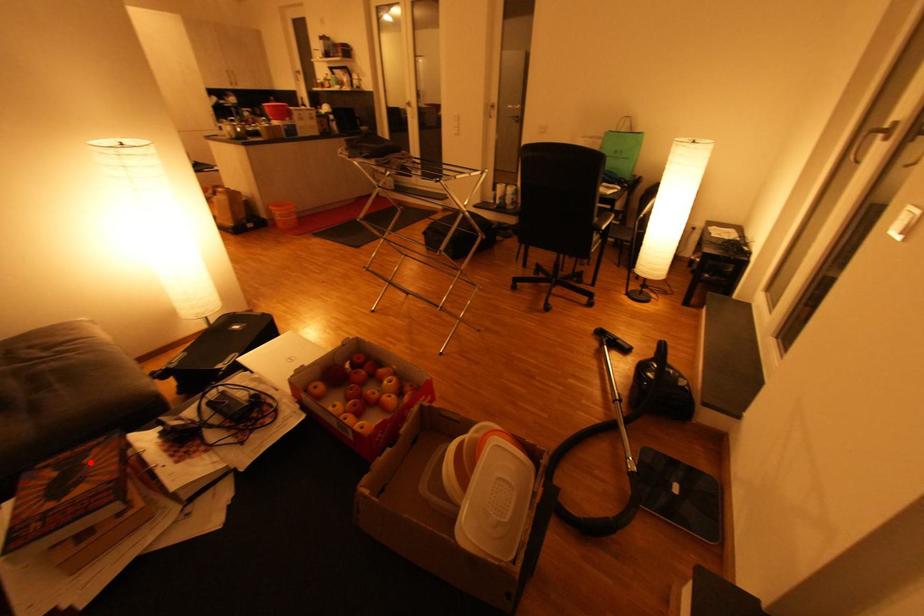
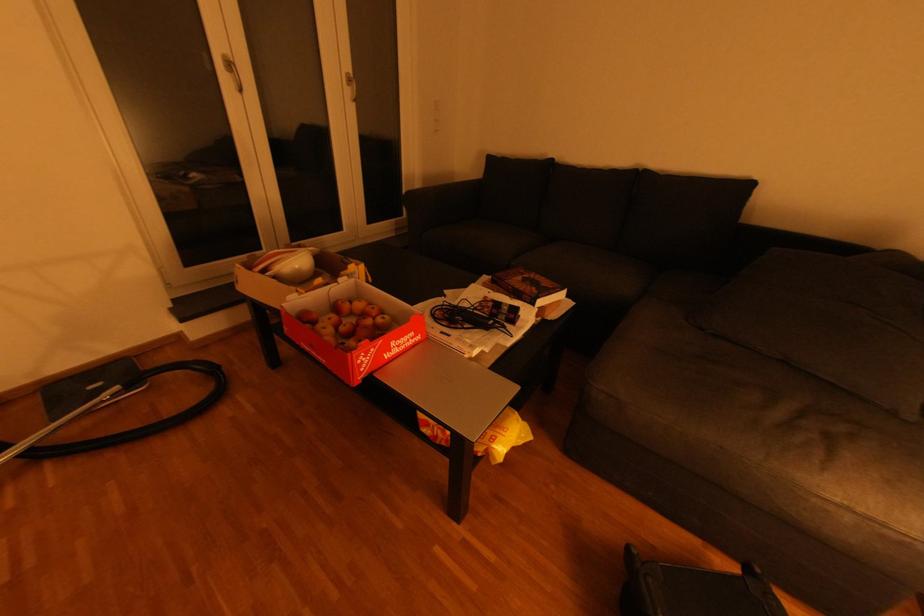
In the second image, find the point that corresponds to the highlighted location in the first image.

(539, 289)